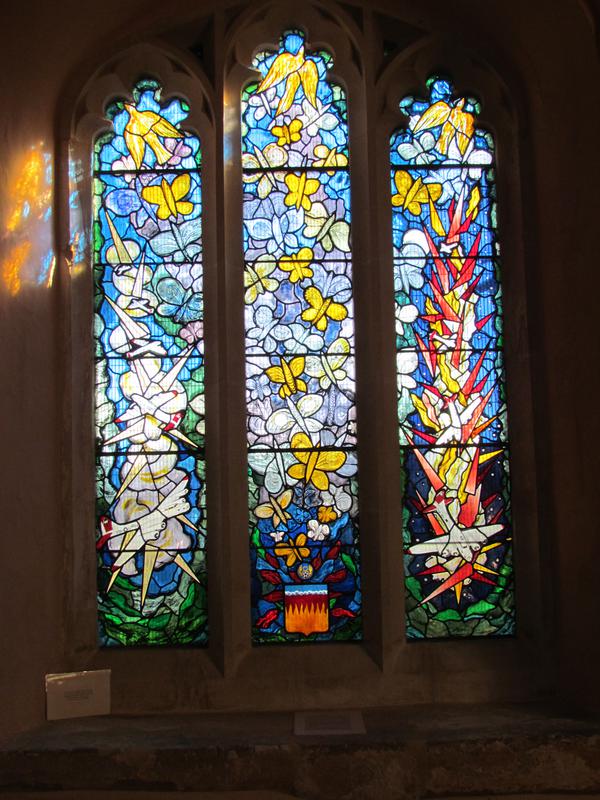
The width and height of the screenshot is (600, 800). In order to click on yellow spot on wall in this screenshot , I will do `click(29, 168)`, `click(16, 206)`, `click(15, 276)`.